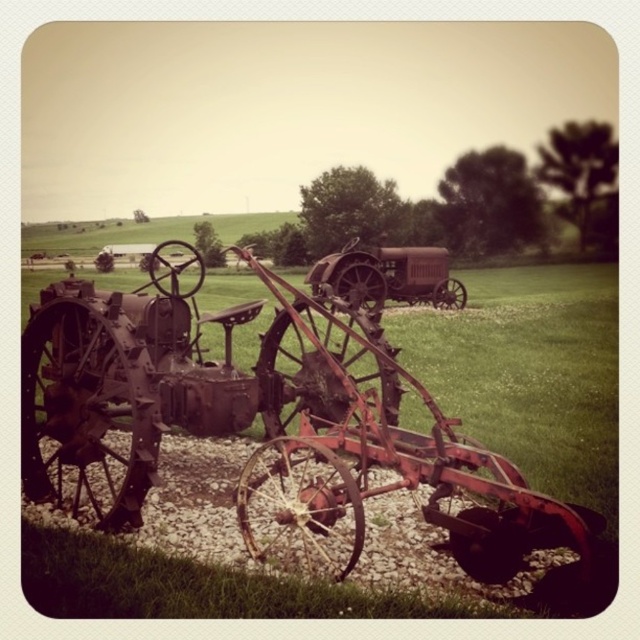
Question: Does rusty metal tractor at left appear over rusty metal tractor at center?

Choices:
 (A) no
 (B) yes

Answer: (B)

Question: Is rusty metal tractor at left bigger than rusty metal tractor at center?

Choices:
 (A) yes
 (B) no

Answer: (A)

Question: Can you confirm if rusty metal tractor at left is wider than rusty metal tractor at center?

Choices:
 (A) yes
 (B) no

Answer: (A)

Question: Which of the following is the closest to the observer?

Choices:
 (A) rusty metal tractor at center
 (B) rusty metal tractor at left

Answer: (B)

Question: Which point is farther to the camera?

Choices:
 (A) (435, 269)
 (B) (244, 492)

Answer: (A)

Question: Which point is closer to the camera?

Choices:
 (A) rusty metal tractor at left
 (B) rusty metal tractor at center

Answer: (A)